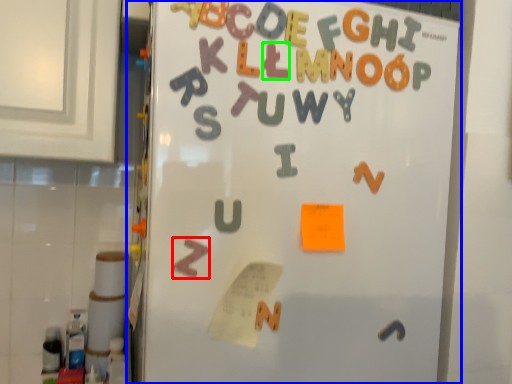
Question: Estimate the real-world distances between objects in this image. Which object is closer to alphabet (highlighted by a red box), refrigerator (highlighted by a blue box) or letter (highlighted by a green box)?

Choices:
 (A) refrigerator
 (B) letter

Answer: (A)